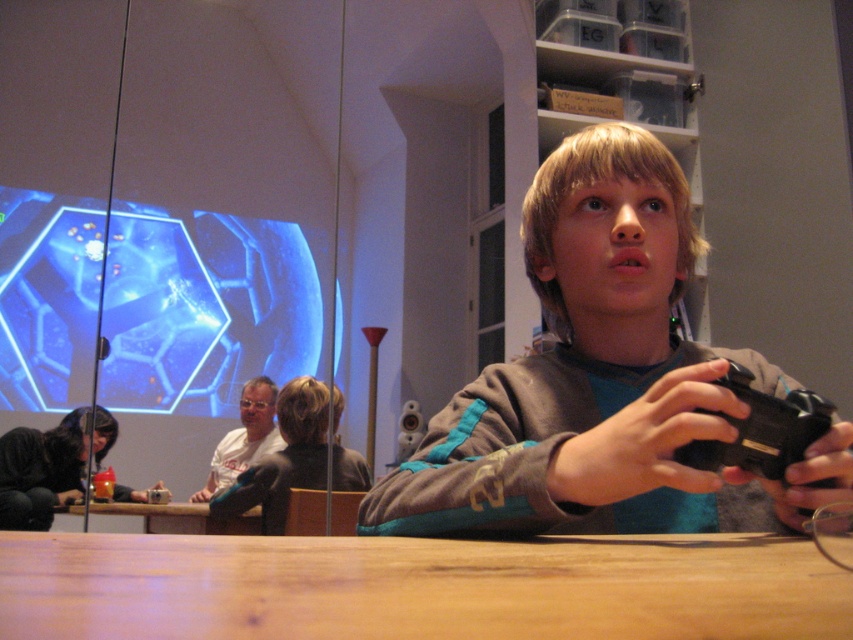
You are a photographer setting up for a photo shoot in the living room. You need to position your equipment so that the wooden table at lower center and the black matte camera at lower right are both in frame. Based on their positions, which object is closer to the left side of the photo?

The wooden table at lower center is to the left of the black matte camera at lower right, so it is closer to the left side of the photo.

You are setting up a video call and need to position the black matte camera at lower right so it can capture both the brown wooden table at lower center and the boy sitting there. Based on their positions, will the camera be able to see the boy and the table clearly?

The black matte camera at lower right is located above the brown wooden table at lower center, so it should be able to capture both the table and the boy sitting at it clearly from an elevated angle.